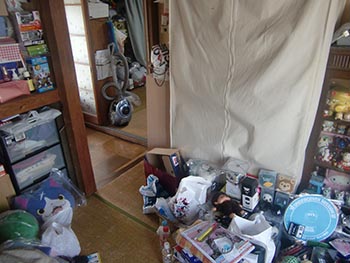
At what (x,y) coordinates should I click in order to perform the action: click on cd. Please return your answer as a coordinate pair (x, y). Looking at the image, I should click on (243, 168).